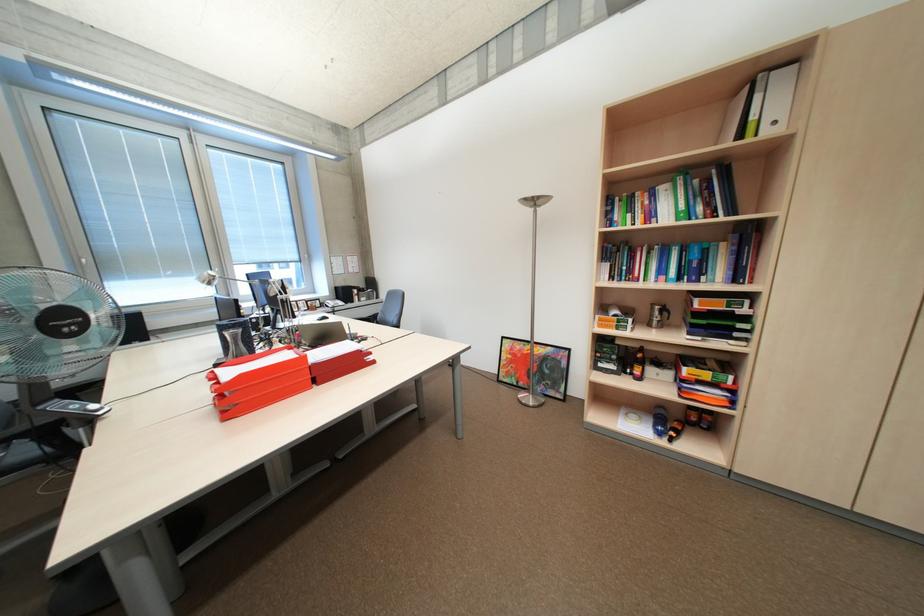
What do you see at coordinates (535, 201) in the screenshot?
I see `the desk lamp head` at bounding box center [535, 201].